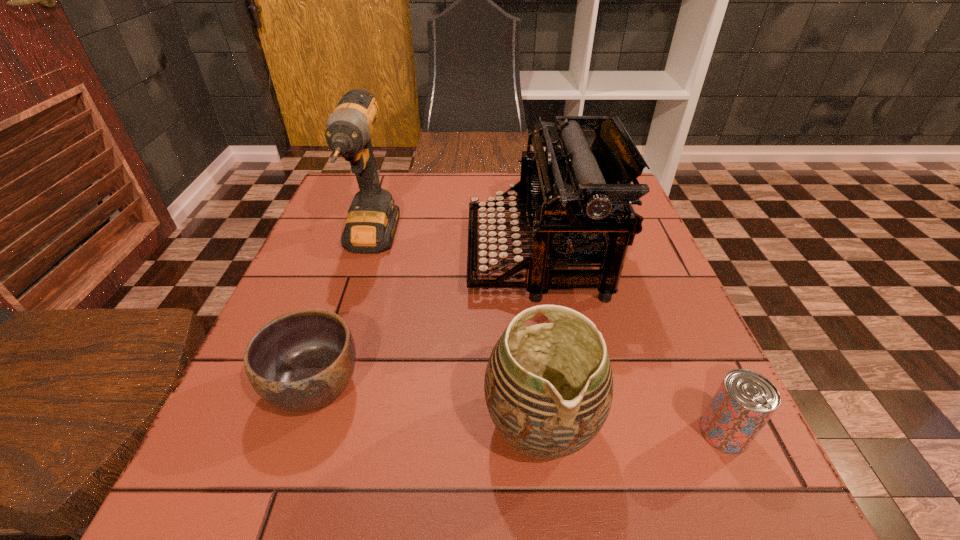
You are a GUI agent. You are given a task and a screenshot of the screen. Output one action in this format:
    pyautogui.click(x=<x>, y=<y>)
    Task: Click on the object that is at the far right corner
    
    Given the screenshot: What is the action you would take?
    pyautogui.click(x=576, y=196)

The width and height of the screenshot is (960, 540). In the image, there is a desktop. Identify the location of vacant space at the far edge. (493, 177).

Identify the location of free space at the left edge of the desktop. Image resolution: width=960 pixels, height=540 pixels. (232, 417).

The width and height of the screenshot is (960, 540). In the image, there is a desktop. What are the coordinates of `free space at the right edge` in the screenshot? It's located at (660, 322).

The width and height of the screenshot is (960, 540). In order to click on free point between the drill and the second tallest object in this screenshot , I will do `click(454, 249)`.

This screenshot has width=960, height=540. Find the location of `vacant space that's between the typewriter and the bowl`. vacant space that's between the typewriter and the bowl is located at coordinates (426, 321).

In order to click on free space that is in between the bowl and the pottery in this screenshot , I will do `click(428, 405)`.

Where is `unoccupied position between the rightmost object and the fourth shortest object`? The image size is (960, 540). unoccupied position between the rightmost object and the fourth shortest object is located at coordinates (x=631, y=343).

At what (x,y) coordinates should I click in order to perform the action: click on free space between the typewriter and the bowl. Please return your answer as a coordinate pair (x, y). Looking at the image, I should click on (426, 321).

Locate an element on the screen. free space that is in between the typewriter and the bowl is located at coordinates (426, 321).